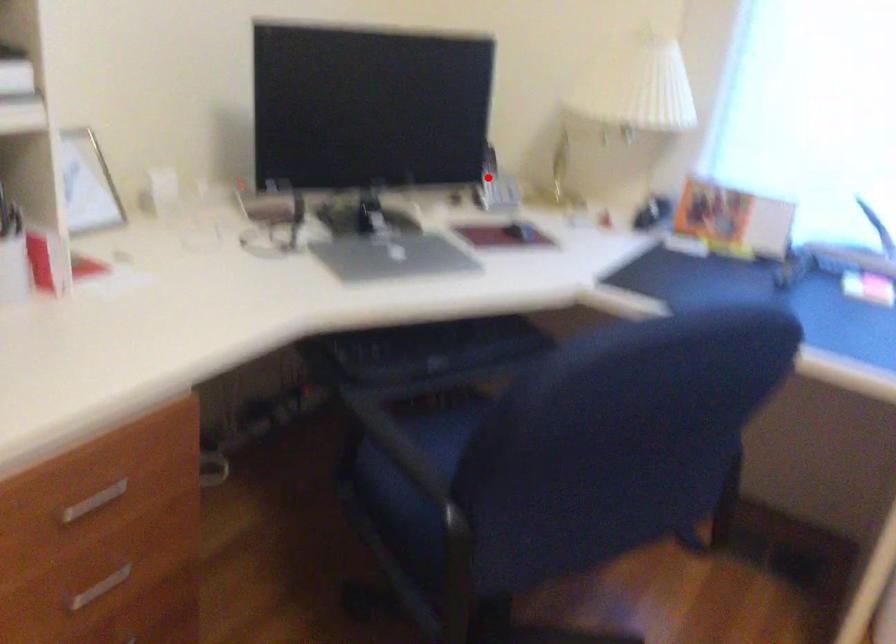
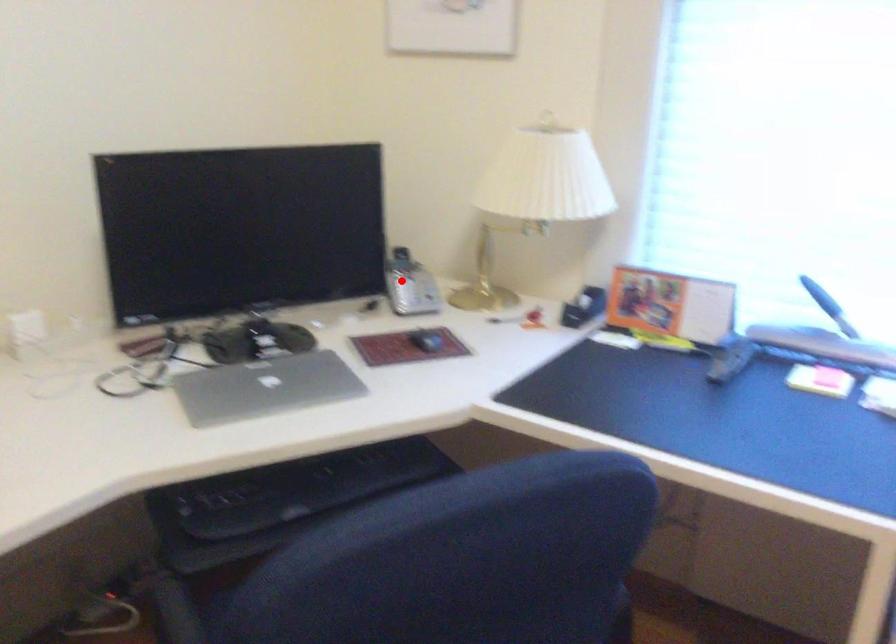
I am providing you with two images of the same scene from different viewpoints. A red point is marked on the first image and another point is marked on the second image. Do the highlighted points in image1 and image2 indicate the same real-world spot?

Yes